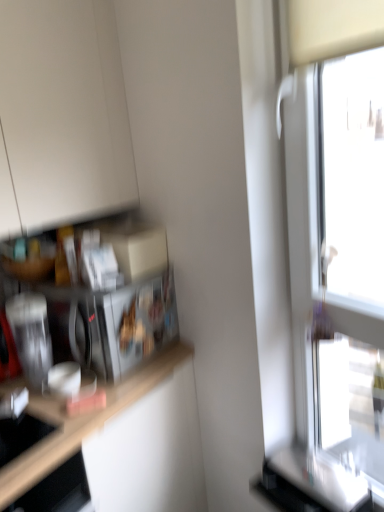
Question: Considering the relative sizes of transparent glass window at right and brushed metal toaster at left in the image provided, is transparent glass window at right shorter than brushed metal toaster at left?

Choices:
 (A) yes
 (B) no

Answer: (B)

Question: Is transparent glass window at right bigger than brushed metal toaster at left?

Choices:
 (A) no
 (B) yes

Answer: (B)

Question: Is brushed metal toaster at left at the back of transparent glass window at right?

Choices:
 (A) no
 (B) yes

Answer: (A)

Question: Is transparent glass window at right directly adjacent to brushed metal toaster at left?

Choices:
 (A) yes
 (B) no

Answer: (B)

Question: From the image's perspective, is transparent glass window at right over brushed metal toaster at left?

Choices:
 (A) yes
 (B) no

Answer: (A)

Question: Can you confirm if transparent glass window at right is wider than brushed metal toaster at left?

Choices:
 (A) no
 (B) yes

Answer: (B)

Question: Is brushed metal toaster at left at the left side of transparent glass window at right?

Choices:
 (A) yes
 (B) no

Answer: (A)

Question: From a real-world perspective, is brushed metal toaster at left on transparent glass window at right?

Choices:
 (A) no
 (B) yes

Answer: (A)

Question: Can you confirm if brushed metal toaster at left is smaller than transparent glass window at right?

Choices:
 (A) no
 (B) yes

Answer: (B)

Question: Would you say transparent glass window at right is part of brushed metal toaster at left's contents?

Choices:
 (A) yes
 (B) no

Answer: (B)

Question: Is brushed metal toaster at left not inside transparent glass window at right?

Choices:
 (A) yes
 (B) no

Answer: (A)

Question: Does brushed metal toaster at left come in front of transparent glass window at right?

Choices:
 (A) yes
 (B) no

Answer: (B)

Question: Is metallic silver microwave at left at the right side of transparent glass window at right?

Choices:
 (A) yes
 (B) no

Answer: (B)